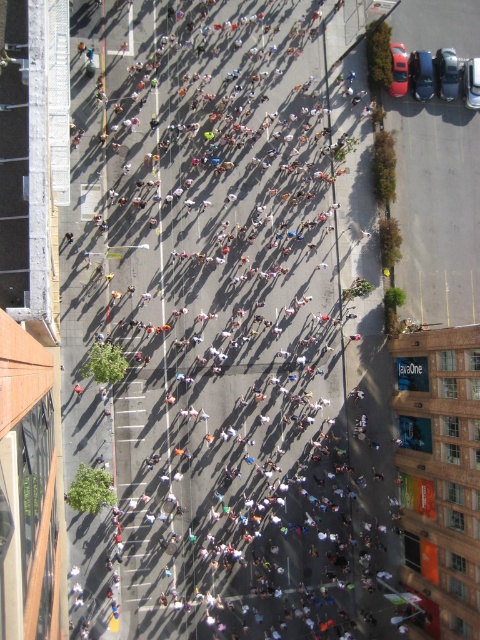
You are a pedestrian trying to cross the street at the upper right corner of the image. You see a shiny black sedan at upper right and a metallic silver car at upper right. Which car is closer to you?

The shiny black sedan at upper right is closer to you because it is positioned further to the viewer than the metallic silver car at upper right.

You are a photographer standing at the edge of the urban street scene. You want to take a photo that includes both the point at coordinates (410, 52) and the point at coordinates (395, 61). Which point should you focus on first to ensure both are in focus?

You should focus on the point at coordinates (410, 52) first because it is closer to the camera than the point at coordinates (395, 61). By focusing on the closer point, the farther point will also be within the depth of field.

You are a delivery drone that needs to land on the street. You see the shiny black sedan at upper right and the metallic silver car at upper right. Which car is closer to the right edge of the street?

The shiny black sedan at upper right is positioned on the right side of metallic silver car at upper right, so the shiny black sedan at upper right is closer to the right edge of the street.